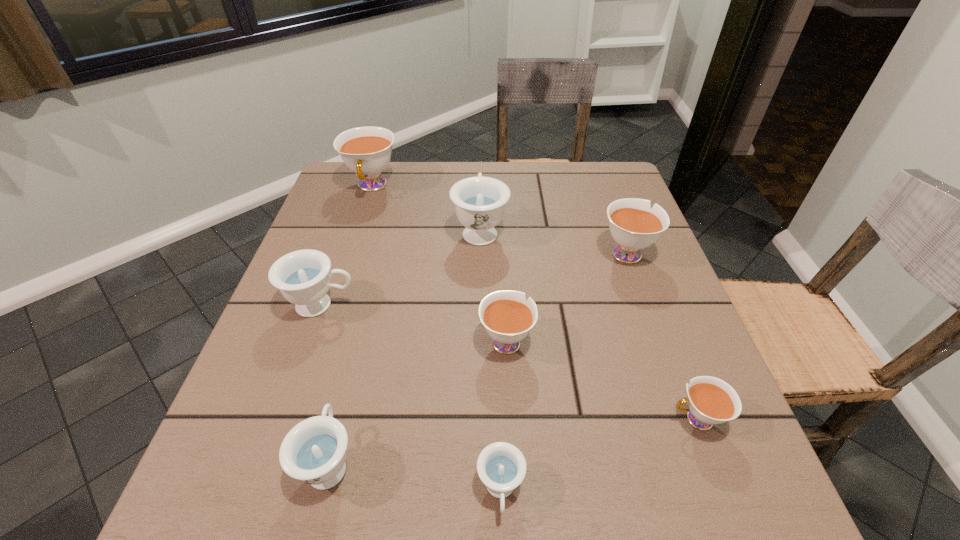
Locate an element on the screen. Image resolution: width=960 pixels, height=540 pixels. vacant region at the near edge is located at coordinates (381, 495).

Identify the location of vacant space at the left edge. The height and width of the screenshot is (540, 960). (279, 431).

Where is `free location at the right edge of the desktop`? free location at the right edge of the desktop is located at coordinates (593, 248).

This screenshot has height=540, width=960. Find the location of `free space between the biggest white teacup and the third nearest blue teacup`. free space between the biggest white teacup and the third nearest blue teacup is located at coordinates (347, 246).

Locate an element on the screen. Image resolution: width=960 pixels, height=540 pixels. vacant area that lies between the biggest blue teacup and the smallest blue teacup is located at coordinates (491, 360).

The width and height of the screenshot is (960, 540). What are the coordinates of `free point between the third nearest white teacup and the smallest blue teacup` in the screenshot? It's located at (564, 372).

Where is `free space between the third smallest blue teacup and the farthest blue teacup`? free space between the third smallest blue teacup and the farthest blue teacup is located at coordinates (401, 267).

This screenshot has width=960, height=540. What are the coordinates of `free space between the nearest white teacup and the second smallest blue teacup` in the screenshot? It's located at (513, 441).

Find the location of `free space between the third biggest blue teacup and the biggest blue teacup`. free space between the third biggest blue teacup and the biggest blue teacup is located at coordinates (405, 346).

Where is `free space between the second smallest white teacup and the second smallest blue teacup`? This screenshot has height=540, width=960. free space between the second smallest white teacup and the second smallest blue teacup is located at coordinates (418, 401).